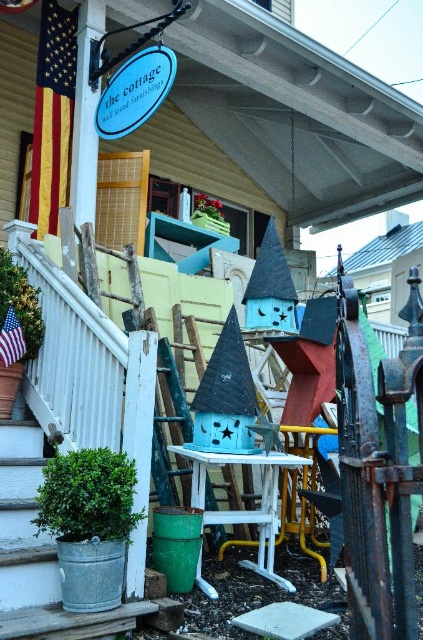
You are a delivery person trying to place a new birdhouse on the porch. The new birdhouse is the same size as the green galvanized bucket at lower left. Can you fit it in the space where the matte blue birdhouse at center currently is without moving anything else?

The matte blue birdhouse at center might be wider than green galvanized bucket at lower left, so there is a possibility that the space where the matte blue birdhouse is currently placed may not be wide enough for the new birdhouse which is the same size as the green galvanized bucket at lower left. It is recommended to check the dimensions before placing it.